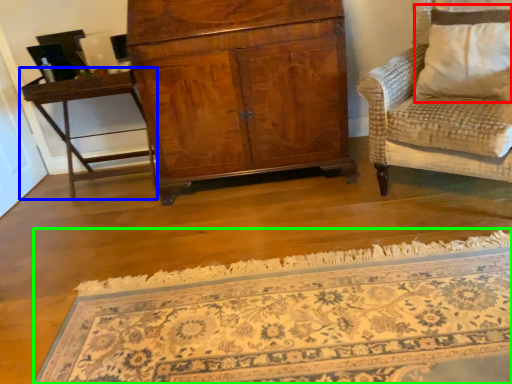
Question: Which object is the farthest from pillow (highlighted by a red box)? Choose among these: table (highlighted by a blue box) or mat (highlighted by a green box).

Choices:
 (A) table
 (B) mat

Answer: (A)